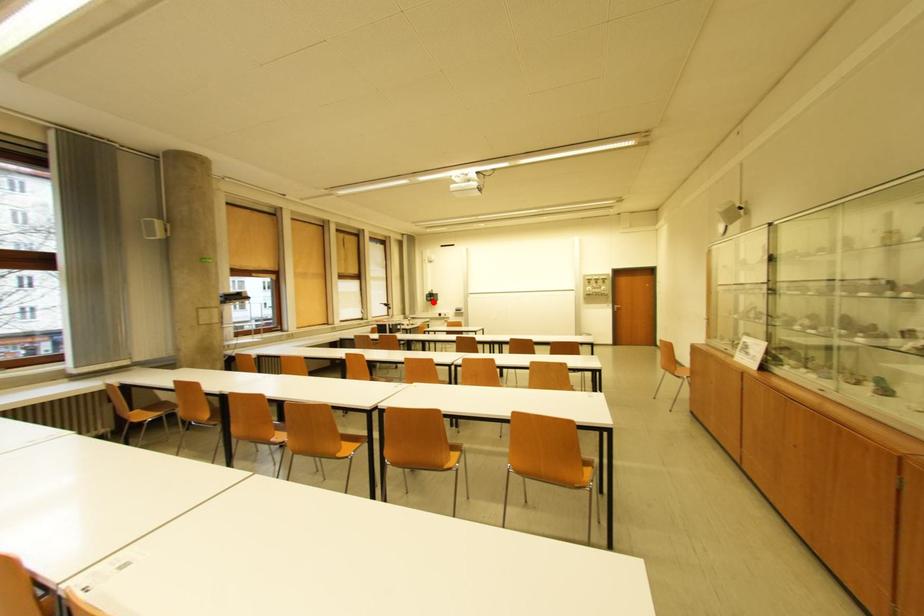
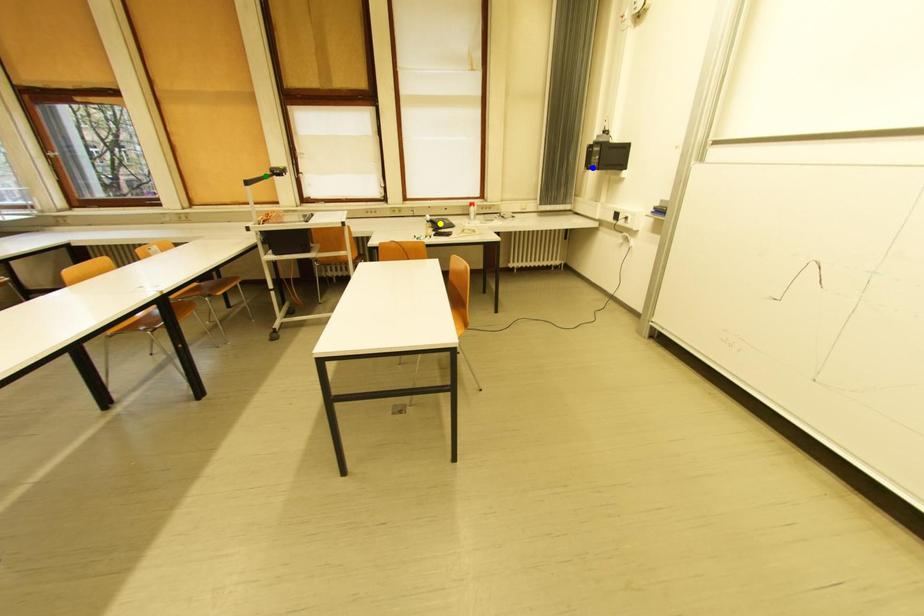
Question: I am providing you with two images of the same scene from different viewpoints. A red point is marked on the first image. You are given multiple points on the second image. Which mark in image 2 goes with the point in image 1?

Choices:
 (A) blue point
 (B) yellow point
 (C) green point

Answer: (A)